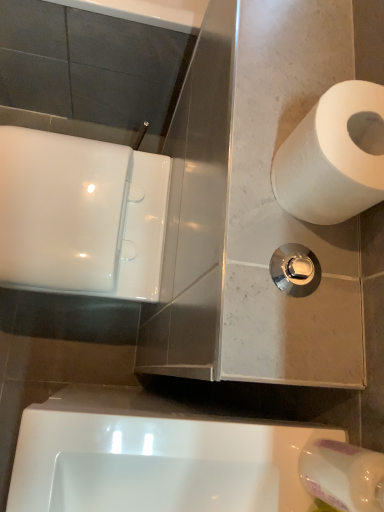
Locate an element on the screen. vacant space that is to the left of white paper at right, the 1th toilet paper when ordered from top to bottom is located at coordinates (254, 94).